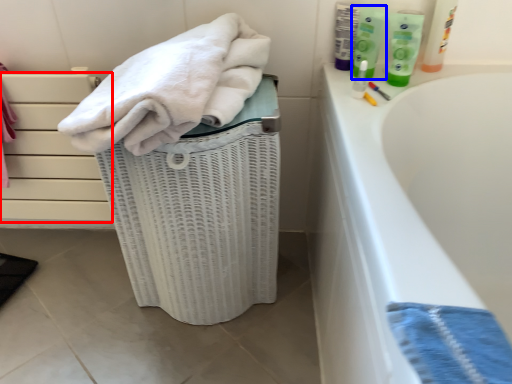
Question: Which object appears closest to the camera in this image, drawer (highlighted by a red box) or cleaning product (highlighted by a blue box)?

Choices:
 (A) drawer
 (B) cleaning product

Answer: (B)